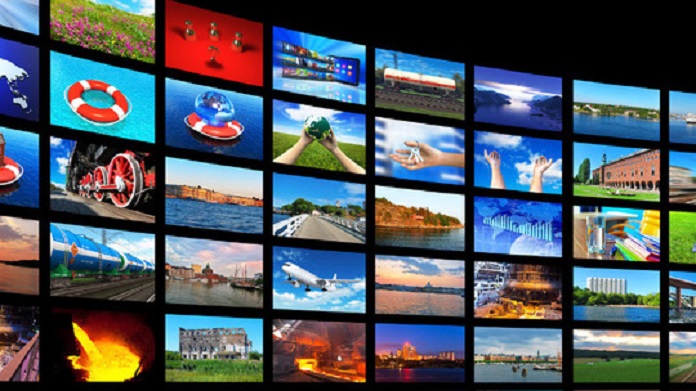
Image resolution: width=696 pixels, height=391 pixels. Find the location of `bottom row of pictures`. bottom row of pictures is located at coordinates (21, 332), (90, 344), (223, 346), (303, 350), (422, 352), (516, 355), (601, 355), (681, 356).